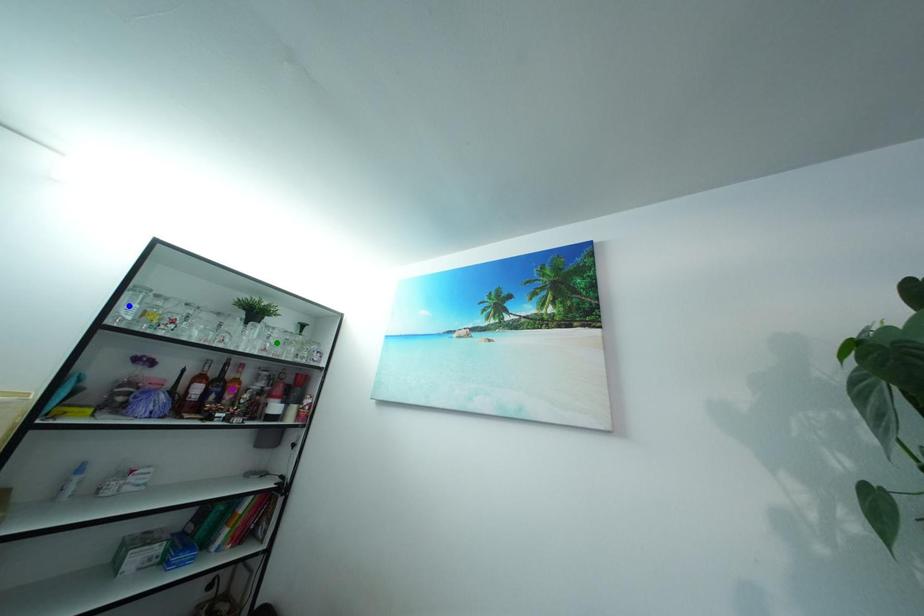
Order these from nearest to farthest:
- purple point
- blue point
- green point

blue point → purple point → green point